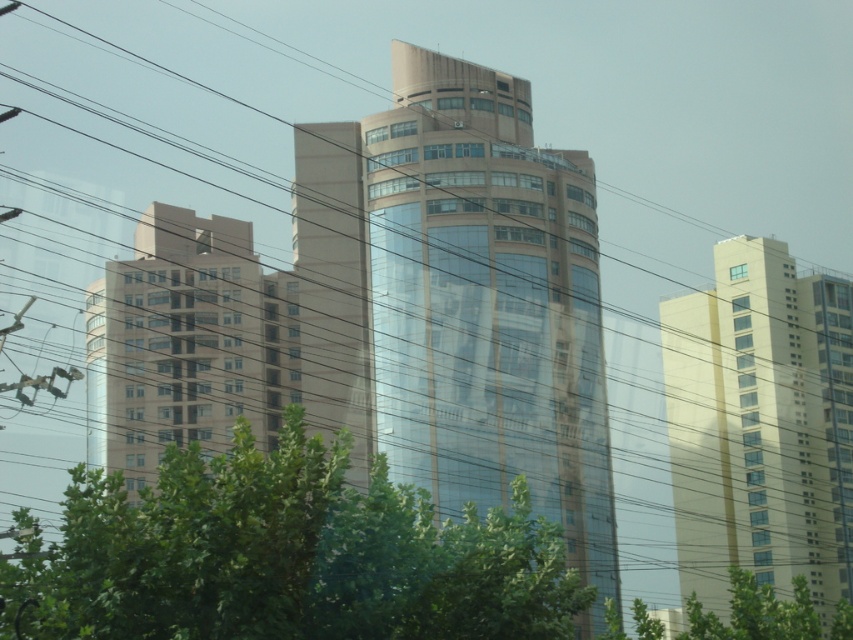
Based on the photo, who is more distant from viewer, [482,442] or [184,545]?

The point [482,442] is behind.

Which is more to the right, matte glass building at center or green leafy tree at center?

Positioned to the right is matte glass building at center.

Which is in front, point (422, 300) or point (521, 524)?

Positioned in front is point (521, 524).

The image size is (853, 640). In order to click on matte glass building at center in this screenshot , I will do `click(457, 301)`.

Between matte glass building at center and yellow/golden glass building at right, which one appears on the left side from the viewer's perspective?

Positioned to the left is matte glass building at center.

Between point (438, 492) and point (782, 404), which one is positioned in front?

Point (438, 492) is in front.

Identify the location of matte glass building at center. Image resolution: width=853 pixels, height=640 pixels. (457, 301).

Locate an element on the screen. matte glass building at center is located at coordinates (457, 301).

Between green leafy tree at center and yellow/golden glass building at right, which one has more height?

yellow/golden glass building at right is taller.

Is green leafy tree at center below yellow/golden glass building at right?

No.

Does point (431, 618) come farther from viewer compared to point (724, 481)?

No, (431, 618) is in front of (724, 481).

I want to click on green leafy tree at center, so click(288, 556).